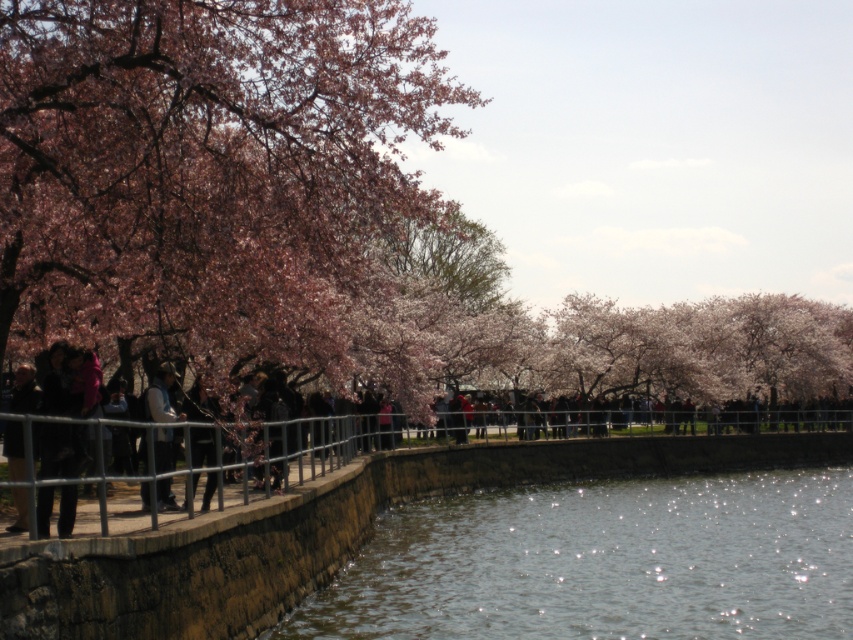
Is clear water at lower center above denim jacket at center?

Actually, clear water at lower center is below denim jacket at center.

Does clear water at lower center appear on the right side of denim jacket at center?

Correct, you'll find clear water at lower center to the right of denim jacket at center.

Looking at this image, who is more forward, (515, 572) or (154, 429)?

Point (154, 429) is more forward.

You are a GUI agent. You are given a task and a screenshot of the screen. Output one action in this format:
    pyautogui.click(x=<x>, y=<y>)
    Task: Click on the clear water at lower center
    The height and width of the screenshot is (640, 853).
    Given the screenshot: What is the action you would take?
    pyautogui.click(x=602, y=563)

Can you confirm if pink blossoms at left is wider than dark brown leather jacket at left?

Yes, pink blossoms at left is wider than dark brown leather jacket at left.

Between point (334, 296) and point (10, 397), which one is positioned behind?

The point (10, 397) is more distant.

Find the location of a particular element. This screenshot has width=853, height=640. pink blossoms at left is located at coordinates (207, 173).

Can you confirm if pink blossoms at left is bigger than black fabric person at center?

Indeed, pink blossoms at left has a larger size compared to black fabric person at center.

Does point (285, 216) come behind point (200, 460)?

Yes, point (285, 216) is behind point (200, 460).

I want to click on pink blossoms at left, so click(207, 173).